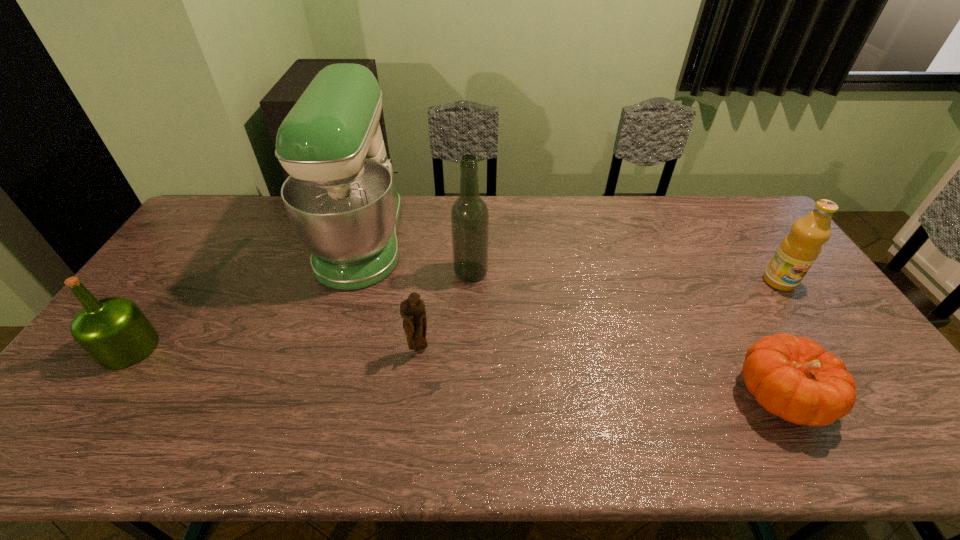
This screenshot has width=960, height=540. Identify the location of the second object from left to right. (340, 196).

At what (x,y) coordinates should I click in order to perform the action: click on the tallest object. Please return your answer as a coordinate pair (x, y). This screenshot has width=960, height=540. Looking at the image, I should click on (340, 196).

This screenshot has width=960, height=540. Find the location of `the fifth shortest object`. the fifth shortest object is located at coordinates (469, 215).

In order to click on liquor in this screenshot , I will do `click(469, 215)`.

The image size is (960, 540). Find the location of `the rightmost object`. the rightmost object is located at coordinates (797, 252).

Where is `the farther olive oil`? The image size is (960, 540). the farther olive oil is located at coordinates (797, 252).

You are a GUI agent. You are given a task and a screenshot of the screen. Output one action in this format:
    pyautogui.click(x=<x>, y=<y>)
    Task: Click on the leftmost object
    The image size is (960, 540).
    Given the screenshot: What is the action you would take?
    pyautogui.click(x=114, y=331)

Locate an element on the screen. the left olive oil is located at coordinates (114, 331).

This screenshot has height=540, width=960. I want to click on figurine, so click(x=413, y=311).

Locate an element on the screen. The image size is (960, 540). pumpkin is located at coordinates 794,378.